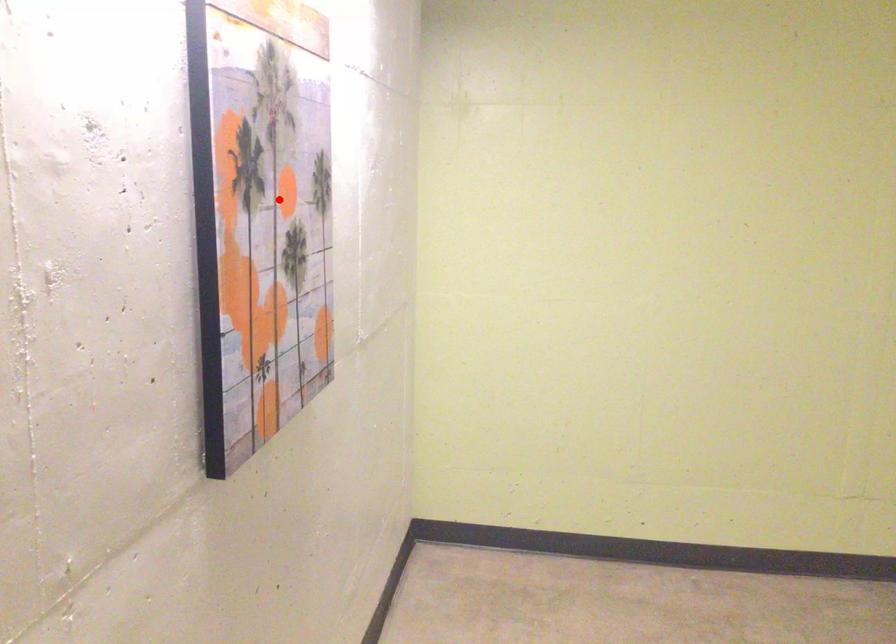
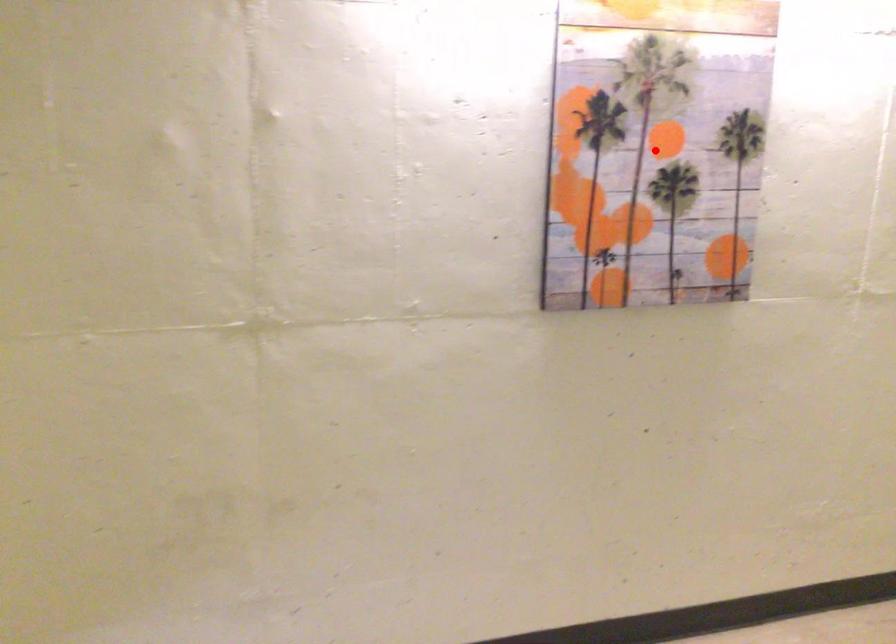
I am providing you with two images of the same scene from different viewpoints. A red point is marked on the first image and another point is marked on the second image. Do the highlighted points in image1 and image2 indicate the same real-world spot?

Yes